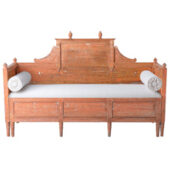
Where is `pillow on right side of bench`? This screenshot has width=170, height=170. pillow on right side of bench is located at coordinates (21, 81).